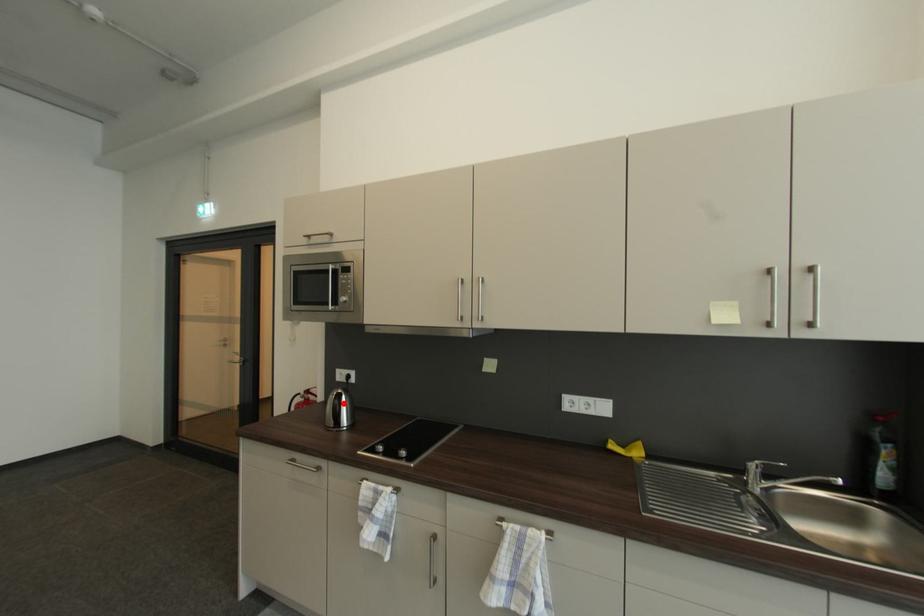
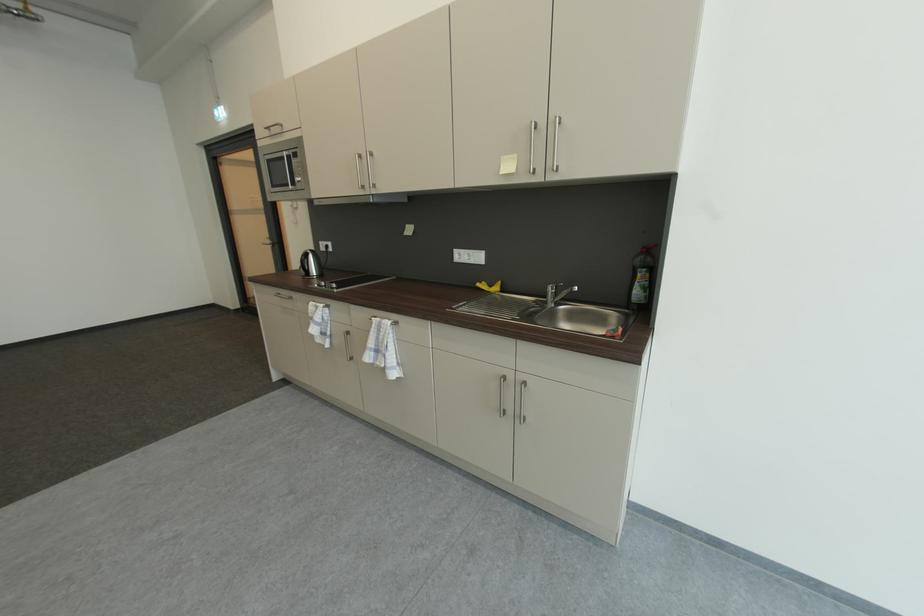
Find the pixel in the second image that matches the highlighted location in the first image.

(310, 259)